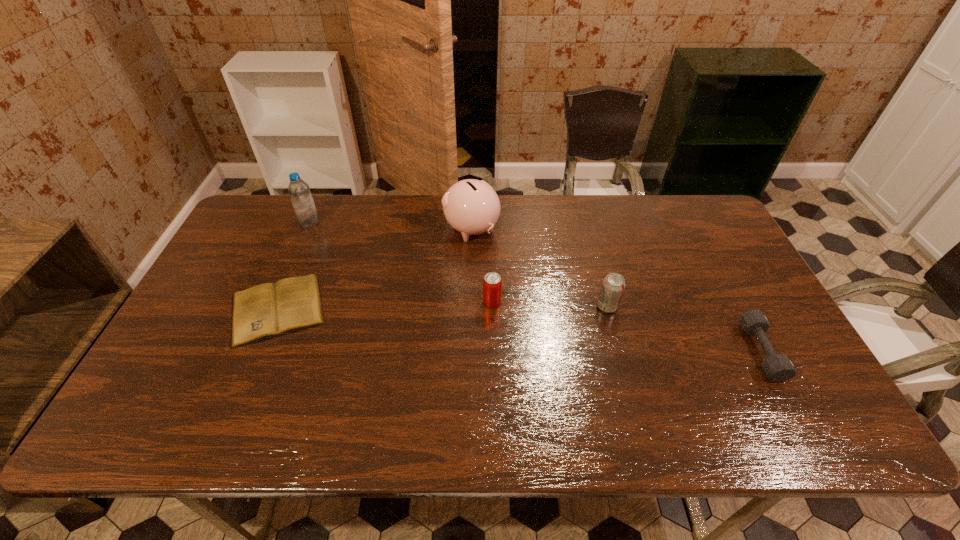
This screenshot has width=960, height=540. Find the location of `water bottle`. water bottle is located at coordinates (299, 191).

I want to click on piggy bank, so [472, 207].

This screenshot has width=960, height=540. I want to click on soda can, so click(x=613, y=285).

Find the location of `can`. can is located at coordinates (492, 283).

The width and height of the screenshot is (960, 540). I want to click on dumbbell, so pos(778,367).

Locate an element on the screen. the rightmost object is located at coordinates (778, 367).

The height and width of the screenshot is (540, 960). I want to click on the shortest object, so click(x=267, y=310).

Image resolution: width=960 pixels, height=540 pixels. What are the coordinates of `free space located 0.370m on the right of the water bottle` in the screenshot? It's located at (430, 222).

Where is `vacant region located 0.290m on the left of the piggy bank`? This screenshot has width=960, height=540. vacant region located 0.290m on the left of the piggy bank is located at coordinates (356, 230).

Locate an element on the screen. free space located 0.060m on the back of the soda can is located at coordinates (601, 283).